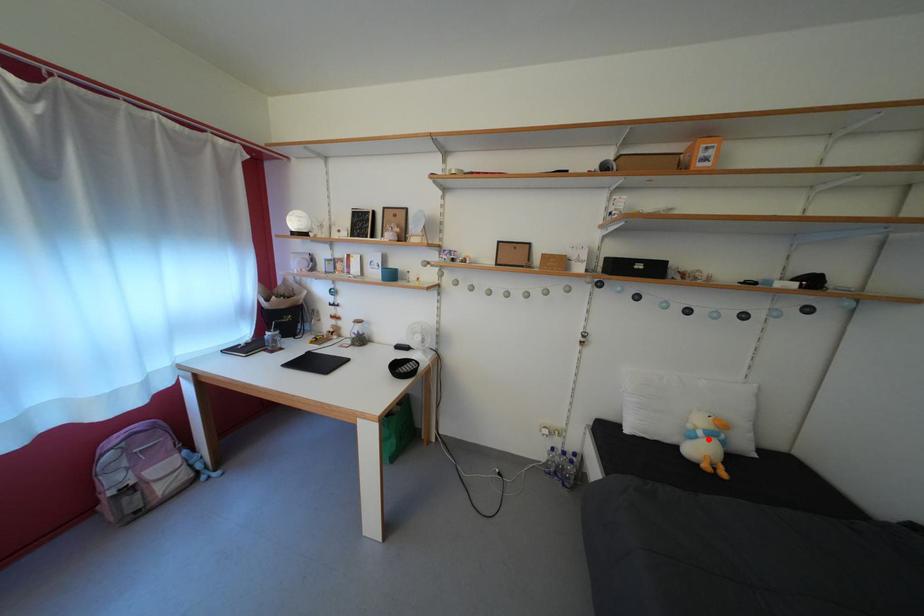
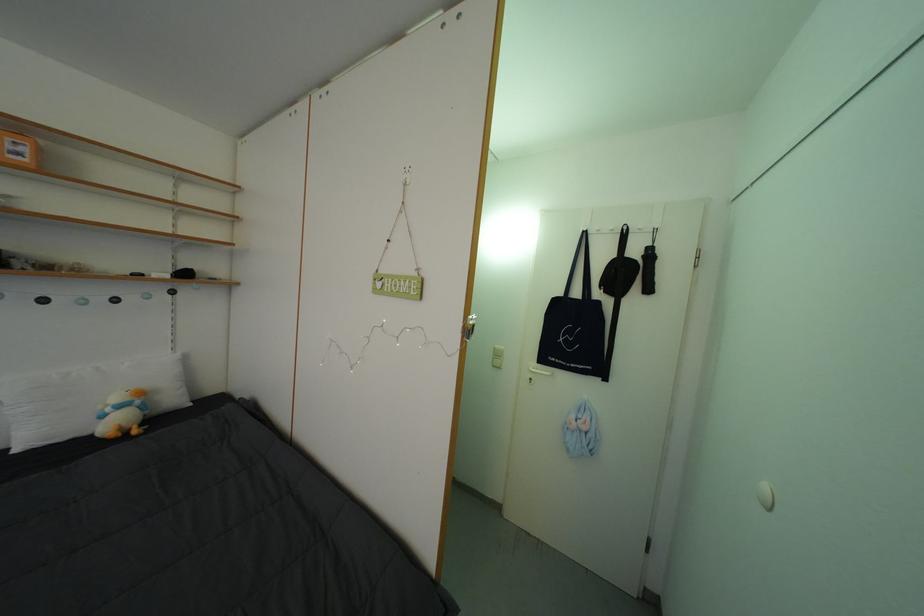
In the second image, find the point that corresponds to the highlighted location in the first image.

(117, 415)